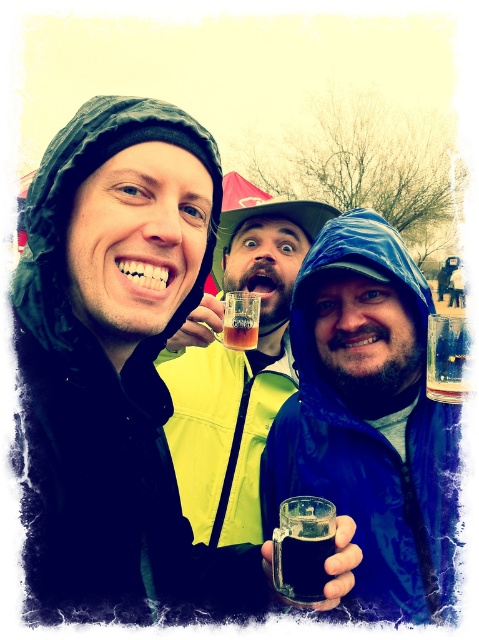
You are a bartender at a party and need to pour a drink into the taller container. Which one should you choose between the matte plastic cup at center and the clear glass at center?

The matte plastic cup at center is much taller than the clear glass at center, so you should choose the matte plastic cup at center to pour the drink into.